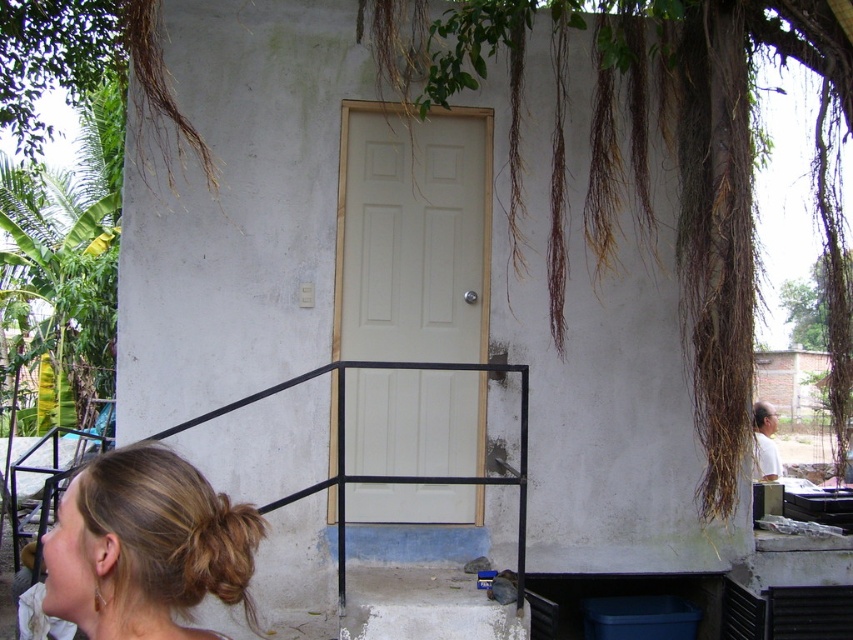
Does concrete stairs at lower center appear under brown fuzzy hair at lower left?

Yes, concrete stairs at lower center is below brown fuzzy hair at lower left.

Does point (363, 573) come in front of point (213, 552)?

That is False.

Where is `concrete stairs at lower center`? This screenshot has height=640, width=853. concrete stairs at lower center is located at coordinates (424, 605).

Can you confirm if concrete stairs at lower center is taller than white matte man at right?

No, concrete stairs at lower center is not taller than white matte man at right.

Which is behind, point (476, 632) or point (755, 467)?

The point (755, 467) is more distant.

In order to click on concrete stairs at lower center in this screenshot , I will do (424, 605).

Is white matte door at center to the right of black metal rail at lower center from the viewer's perspective?

Indeed, white matte door at center is positioned on the right side of black metal rail at lower center.

The image size is (853, 640). Describe the element at coordinates (412, 236) in the screenshot. I see `white matte door at center` at that location.

You are a GUI agent. You are given a task and a screenshot of the screen. Output one action in this format:
    pyautogui.click(x=<x>, y=<y>)
    Task: Click on the white matte door at center
    
    Given the screenshot: What is the action you would take?
    pyautogui.click(x=412, y=236)